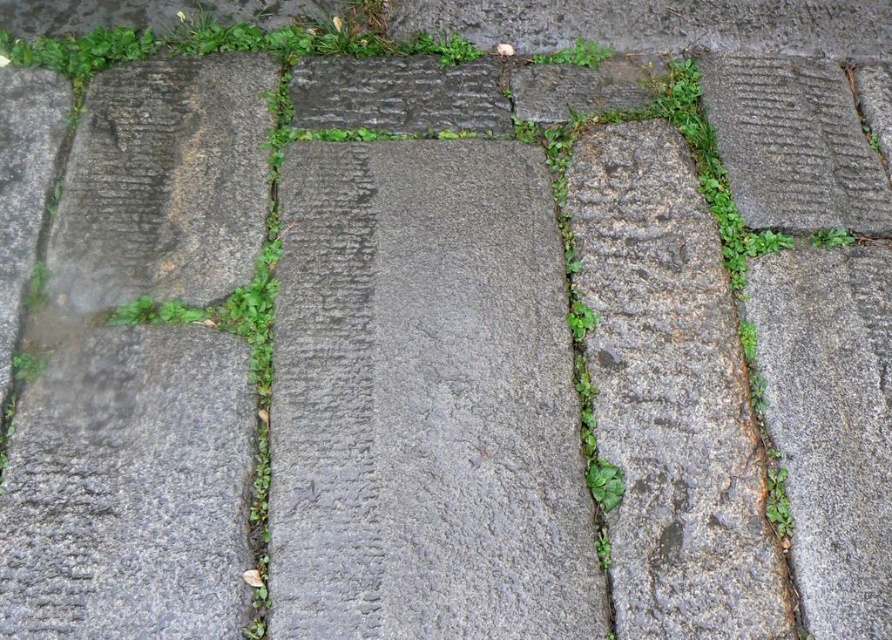
From the picture: You are a gardener trying to mow the green leafy grass at upper center. The gray rough stone at center is in the way. Can you mow the grass without hitting the stone?

The gray rough stone at center is much taller than the green leafy grass at upper center, so you can mow the grass without hitting the stone because the grass is shorter.

You are standing on the stone pathway and want to step onto the green leafy grass at upper center. Which direction should you move from the gray rough stone at center?

The gray rough stone at center is to the left of green leafy grass at upper center, so you should move to the right to reach the green leafy grass at upper center.